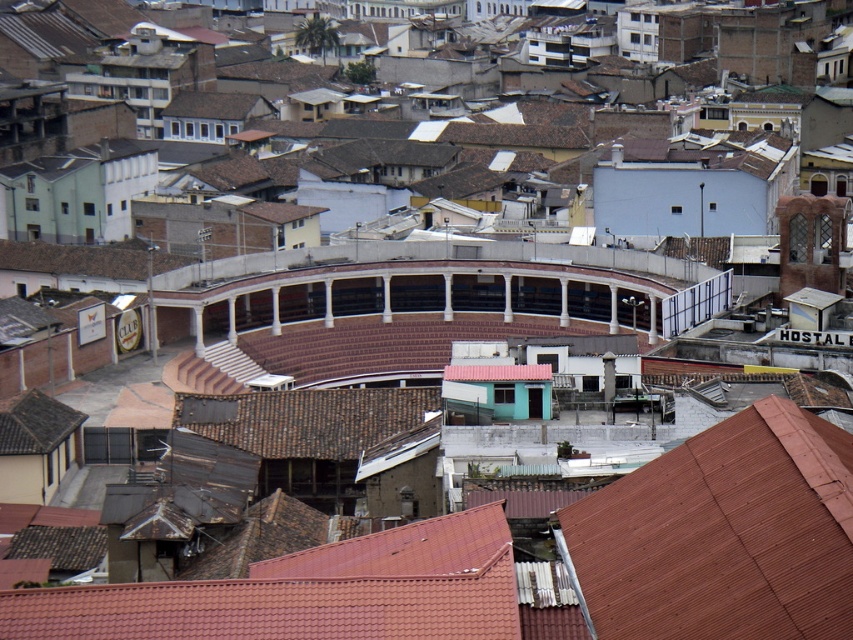
Who is shorter, brown tile roof at center or brown tile roof at lower right?

brown tile roof at lower right

Between brown tile roof at center and brown tile roof at lower right, which one is positioned lower?

Positioned lower is brown tile roof at center.

Image resolution: width=853 pixels, height=640 pixels. In order to click on brown tile roof at center in this screenshot , I will do `click(723, 534)`.

This screenshot has width=853, height=640. Identify the location of brown tile roof at center. (723, 534).